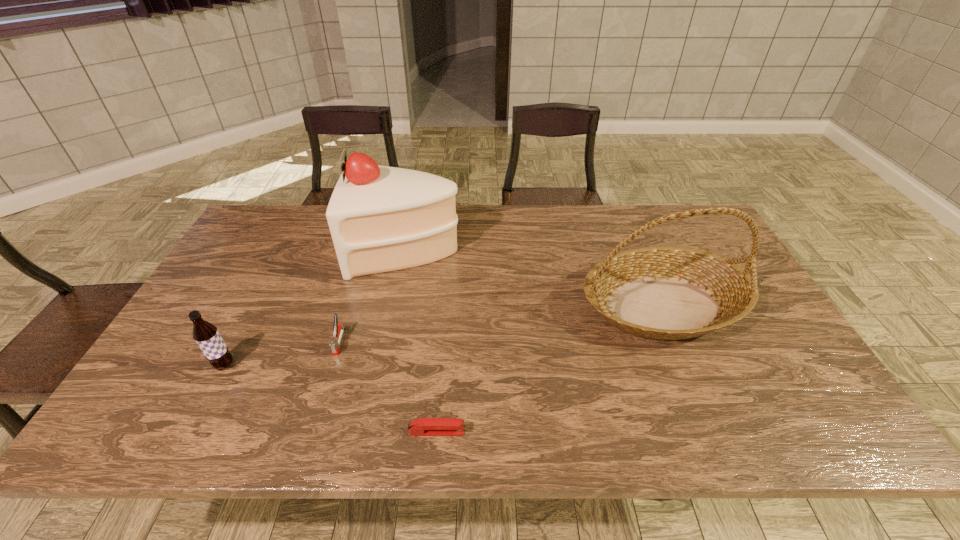
Identify the location of free spot located on the right of the root beer. (313, 365).

I want to click on vacant point located on the handle side of the second shortest object, so click(322, 401).

Locate an element on the screen. This screenshot has height=540, width=960. vacant area situated on the front-facing side of the right stapler is located at coordinates (618, 432).

Locate an element on the screen. object located in the far edge section of the desktop is located at coordinates (381, 218).

Locate an element on the screen. This screenshot has height=540, width=960. object located at the near edge is located at coordinates (423, 426).

Locate an element on the screen. The image size is (960, 540). object that is at the left edge is located at coordinates (206, 335).

Where is `object at the right edge`? object at the right edge is located at coordinates (667, 293).

The height and width of the screenshot is (540, 960). In order to click on vacant area at the far edge in this screenshot , I will do `click(535, 238)`.

What are the coordinates of `free location at the near edge` in the screenshot? It's located at (198, 418).

In the image, there is a desktop. Where is `free space at the left edge`? Image resolution: width=960 pixels, height=540 pixels. free space at the left edge is located at coordinates (217, 291).